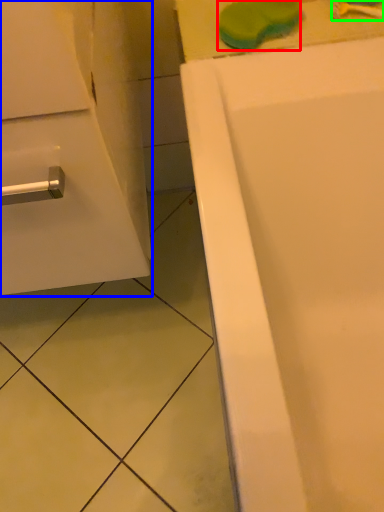
Question: Considering the real-world distances, which object is farthest from soap (highlighted by a red box)? bathroom cabinet (highlighted by a blue box) or toothbrush (highlighted by a green box)?

Choices:
 (A) bathroom cabinet
 (B) toothbrush

Answer: (A)